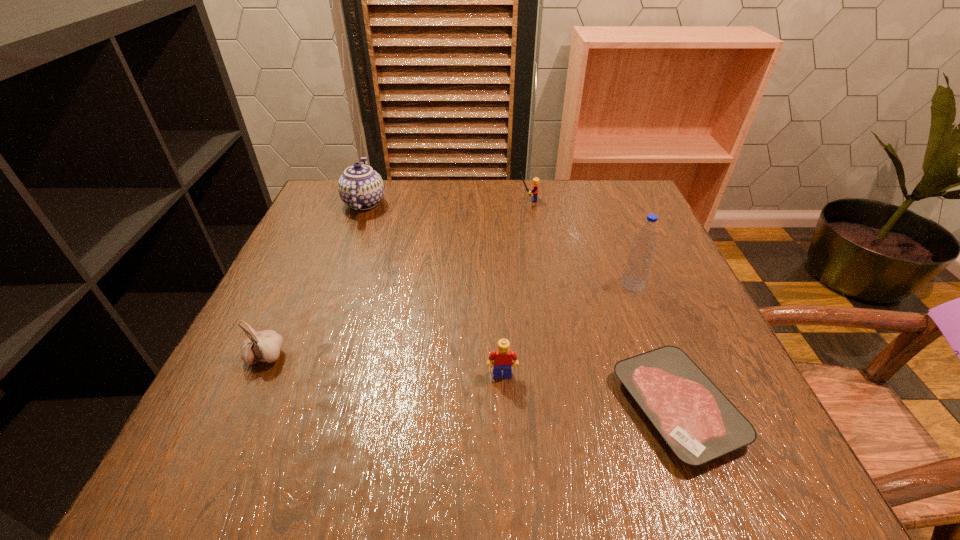
Find the location of `free area in between the shortest object and the left Lego`. free area in between the shortest object and the left Lego is located at coordinates (589, 391).

This screenshot has height=540, width=960. In order to click on vacant point located between the nearer Lego and the garlic in this screenshot , I will do `click(384, 365)`.

At what (x,y) coordinates should I click in order to perform the action: click on vacant area that lies between the fifth shortest object and the third object from left to right. Please return your answer as a coordinate pair (x, y). This screenshot has height=540, width=960. Looking at the image, I should click on (433, 289).

Locate an element on the screen. The height and width of the screenshot is (540, 960). object that is the nearest to the tallest object is located at coordinates (699, 423).

Select which object is the third closest to the garlic. Please provide its 2D coordinates. Your answer should be formatted as a tuple, i.e. [(x, y)], where the tuple contains the x and y coordinates of a point satisfying the conditions above.

[(699, 423)]

Where is `vacant area in the image that satisfies the following two spatial constraints: 1. on the face of the shortest object; 2. on the right side of the nearer Lego`? This screenshot has height=540, width=960. vacant area in the image that satisfies the following two spatial constraints: 1. on the face of the shortest object; 2. on the right side of the nearer Lego is located at coordinates (504, 408).

This screenshot has width=960, height=540. Identify the location of vacant point that satisfies the following two spatial constraints: 1. on the back side of the water bottle; 2. on the left side of the garlic. (300, 284).

You are a GUI agent. You are given a task and a screenshot of the screen. Output one action in this format:
    pyautogui.click(x=<x>, y=<y>)
    Task: Click on the free region that satisfies the following two spatial constraints: 1. on the front-facing side of the right Lego; 2. on the back side of the steak
    The width and height of the screenshot is (960, 540).
    Given the screenshot: What is the action you would take?
    pyautogui.click(x=560, y=408)

Where is `free space that satisfies the following two spatial constraints: 1. on the front-facing side of the third object from right to left; 2. on the right side of the steak`? The height and width of the screenshot is (540, 960). free space that satisfies the following two spatial constraints: 1. on the front-facing side of the third object from right to left; 2. on the right side of the steak is located at coordinates (560, 408).

Where is `free region that satisfies the following two spatial constraints: 1. at the spout of the water bottle; 2. on the right side of the chinaware`? free region that satisfies the following two spatial constraints: 1. at the spout of the water bottle; 2. on the right side of the chinaware is located at coordinates coord(334,284).